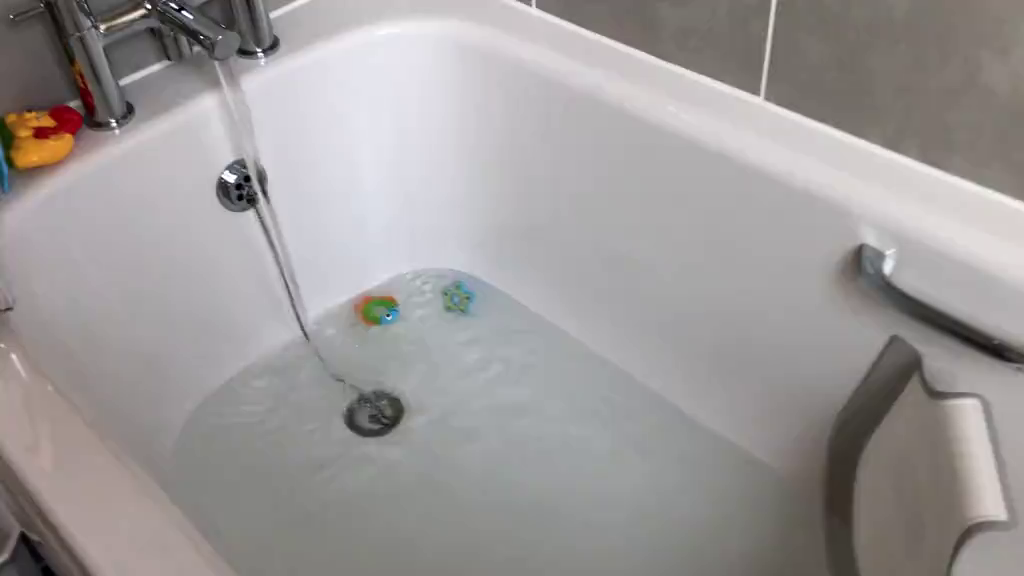
Find the location of a particular element. space to the left of bath fixtures is located at coordinates (24, 90).